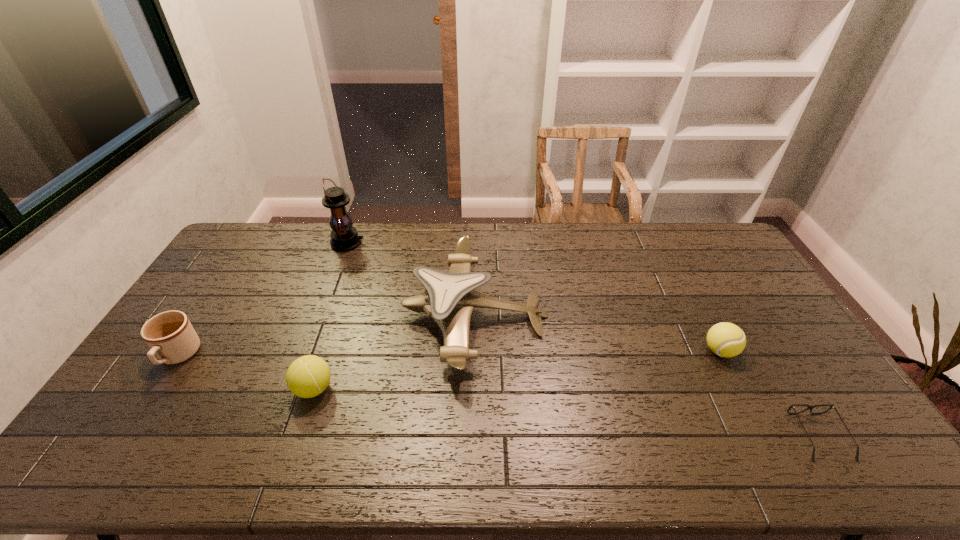
Locate an element on the screen. Image resolution: width=960 pixels, height=540 pixels. the tallest object is located at coordinates (344, 237).

Where is `the farthest object`? This screenshot has width=960, height=540. the farthest object is located at coordinates point(344,237).

Find the location of a particular element. the fourth object from left to right is located at coordinates (449, 299).

At what (x,y) coordinates should I click in order to perform the action: click on mug. Please return your answer as a coordinate pair (x, y). Image resolution: width=960 pixels, height=540 pixels. Looking at the image, I should click on (170, 336).

Find the location of a particular element. the left tennis ball is located at coordinates (308, 376).

This screenshot has height=540, width=960. In order to click on the fifth object from left to right in this screenshot , I will do `click(725, 339)`.

Identify the location of the right tennis ball. (725, 339).

This screenshot has width=960, height=540. I want to click on the rightmost object, so click(831, 405).

You are a GUI agent. You are given a task and a screenshot of the screen. Output one action in this format:
    pyautogui.click(x=<x>, y=<y>)
    Task: Click on the nearest object
    The image size is (960, 540).
    Given the screenshot: What is the action you would take?
    pyautogui.click(x=831, y=405)

Find several locations within vacant space located above the tallest object, indicating its light source. Please provide its 2D coordinates. Your answer should be formatted as a tuple, i.e. [(x, y)], where the tuple contains the x and y coordinates of a point satisfying the conditions above.

[(421, 243)]